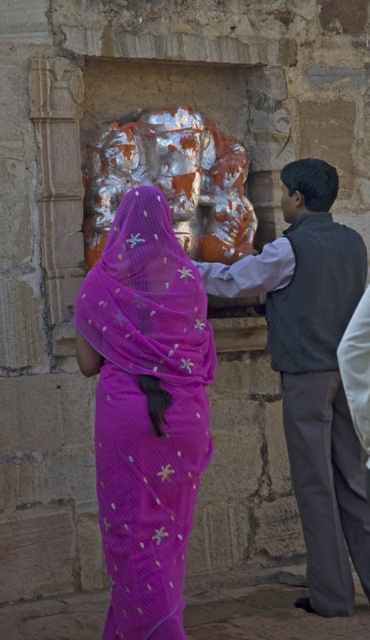
Question: Does purple sheer sari at center have a larger size compared to shiny metallic statue at center?

Choices:
 (A) yes
 (B) no

Answer: (B)

Question: Which of these objects is positioned farthest from the purple sheer sari at center?

Choices:
 (A) shiny metallic statue at center
 (B) gray woolen vest at center

Answer: (A)

Question: Is purple sheer sari at center to the right of gray woolen vest at center from the viewer's perspective?

Choices:
 (A) yes
 (B) no

Answer: (B)

Question: Considering the real-world distances, which object is closest to the purple sheer sari at center?

Choices:
 (A) gray woolen vest at center
 (B) shiny metallic statue at center

Answer: (A)

Question: In this image, where is purple sheer sari at center located relative to shiny metallic statue at center?

Choices:
 (A) above
 (B) below

Answer: (B)

Question: Which point is farther from the camera taking this photo?

Choices:
 (A) tap(361, 497)
 (B) tap(109, 189)

Answer: (B)